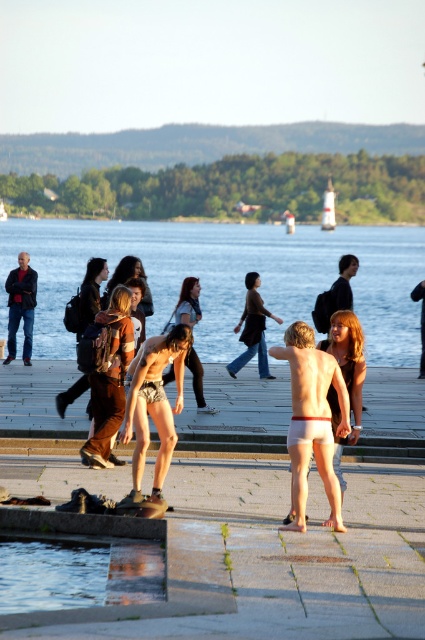
Question: Estimate the real-world distances between objects in this image. Which object is farther from the white matte bikini top at center?

Choices:
 (A) matte black shorts at center
 (B) matte black shirt at center
 (C) clear blue water at center
 (D) white fabric shorts at center

Answer: (C)

Question: Can you confirm if clear blue water at center is thinner than white fabric shorts at center?

Choices:
 (A) yes
 (B) no

Answer: (B)

Question: Is clear blue water at center behind matte black shorts at center?

Choices:
 (A) no
 (B) yes

Answer: (A)

Question: Which of the following is the farthest from the observer?

Choices:
 (A) (418, 400)
 (B) (302, 460)
 (C) (311, 435)
 (D) (53, 340)

Answer: (D)

Question: Estimate the real-world distances between objects in this image. Which object is closer to the matte black shorts at center?

Choices:
 (A) white matte bikini top at center
 (B) white concrete dock at center
 (C) matte black shirt at center
 (D) clear blue water at center

Answer: (B)

Question: In this image, where is white matte bikini top at center located relative to matte black shirt at center?

Choices:
 (A) right
 (B) left

Answer: (B)